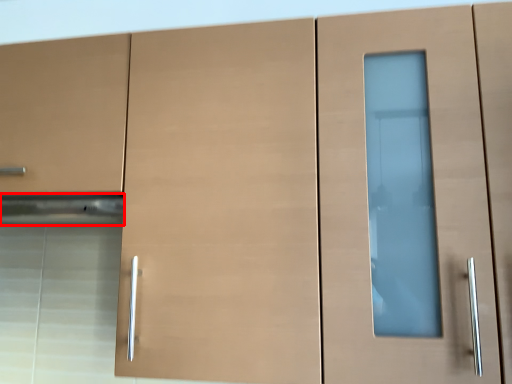
Question: From the image's perspective, what is the correct spatial relationship of exhaust hood (annotated by the red box) in relation to drawer?

Choices:
 (A) above
 (B) below

Answer: (B)